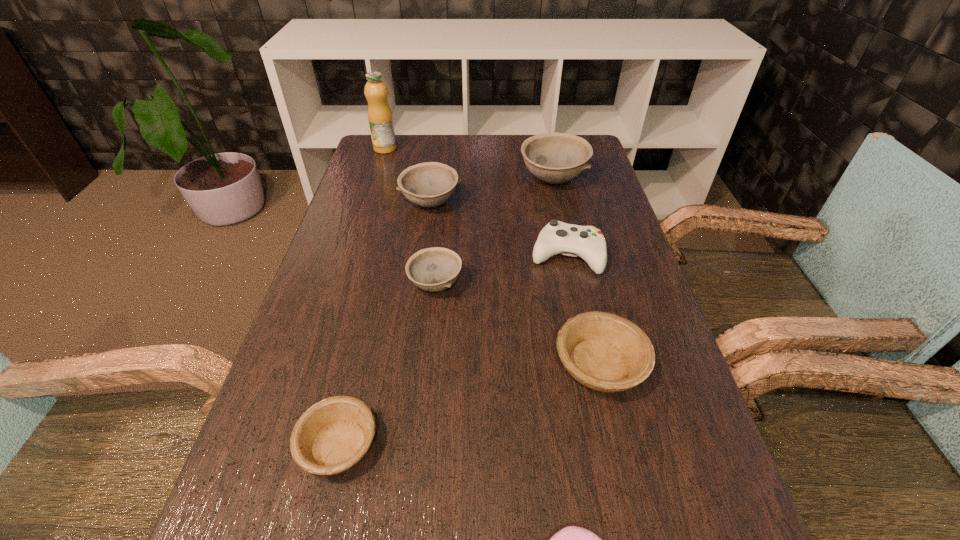
Find the location of a particular element. This screenshot has width=960, height=540. the closest bowl to the fourth farthest bowl is located at coordinates (435, 269).

The height and width of the screenshot is (540, 960). Identify the location of bowl identified as the second closest to the tallest object. (555, 158).

Locate which gray bowl is the third closest to the smaller beige bowl. Please provide its 2D coordinates. Your answer should be formatted as a tuple, i.e. [(x, y)], where the tuple contains the x and y coordinates of a point satisfying the conditions above.

[(555, 158)]

Point out which gray bowl is positioned as the nearest to the seventh tallest object. Please provide its 2D coordinates. Your answer should be formatted as a tuple, i.e. [(x, y)], where the tuple contains the x and y coordinates of a point satisfying the conditions above.

[(435, 269)]

Find the location of `vacant space that satisfies the following two spatial constraints: 1. on the front label of the second tallest bowl; 2. on the right side of the fruit juice`. vacant space that satisfies the following two spatial constraints: 1. on the front label of the second tallest bowl; 2. on the right side of the fruit juice is located at coordinates (368, 203).